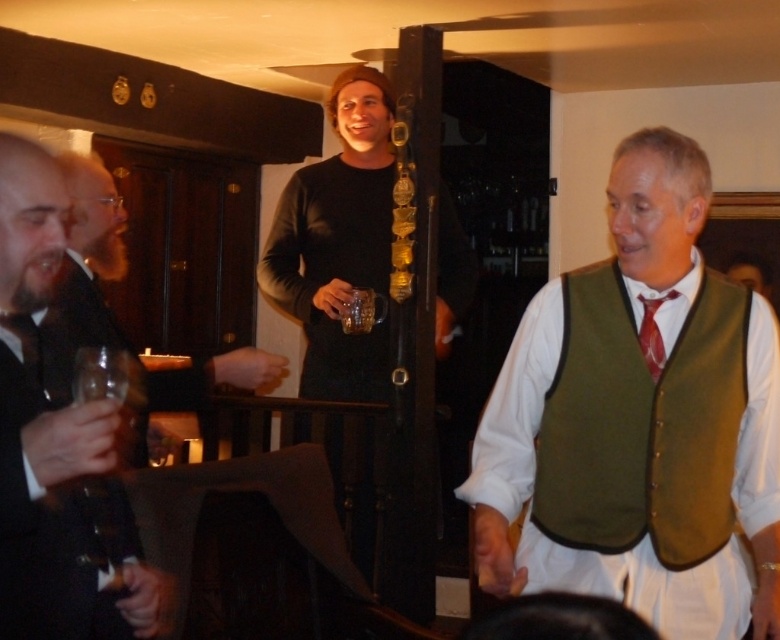
Between point (371, 368) and point (6, 484), which one is positioned in front?

Point (6, 484) is more forward.

Can you confirm if black matte shirt at upper center is thinner than black suit at left?

Incorrect, black matte shirt at upper center's width is not less than black suit at left's.

Measure the distance between point (367, 131) and camera.

The distance of point (367, 131) from camera is 3.34 meters.

Where is `black matte shirt at upper center`? The image size is (780, 640). black matte shirt at upper center is located at coordinates (339, 243).

Between matte black shirt at upper center and red satin tie at right, which one is positioned lower?

red satin tie at right

Is matte black shirt at upper center to the left of red satin tie at right from the viewer's perspective?

Yes, matte black shirt at upper center is to the left of red satin tie at right.

Is point (236, 481) in front of point (644, 340)?

No, (236, 481) is behind (644, 340).

Identify the location of matte black shirt at upper center. (240, 490).

Between green fabric vest at center and translucent glass at center, which one has more height?

green fabric vest at center is taller.

Can you confirm if green fabric vest at center is positioned above translucent glass at center?

Actually, green fabric vest at center is below translucent glass at center.

Does point (725, 547) come farther from viewer compared to point (364, 298)?

No.

I want to click on green fabric vest at center, so click(637, 420).